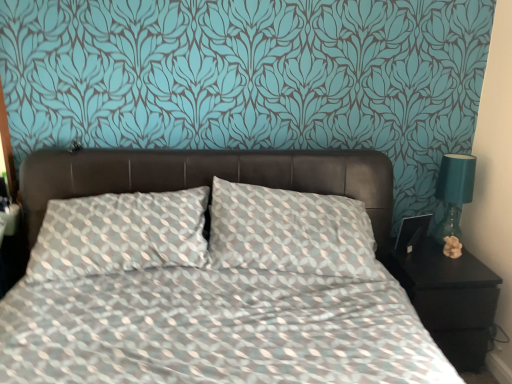
I want to click on vacant region to the left of matte beige figurine at right, so click(x=429, y=260).